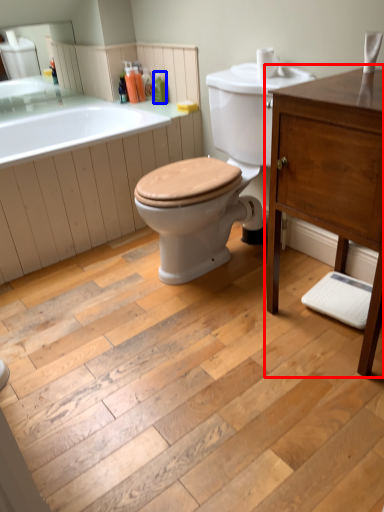
Question: Which object appears farthest to the camera in this image, bathroom cabinet (highlighted by a red box) or toiletry (highlighted by a blue box)?

Choices:
 (A) bathroom cabinet
 (B) toiletry

Answer: (B)